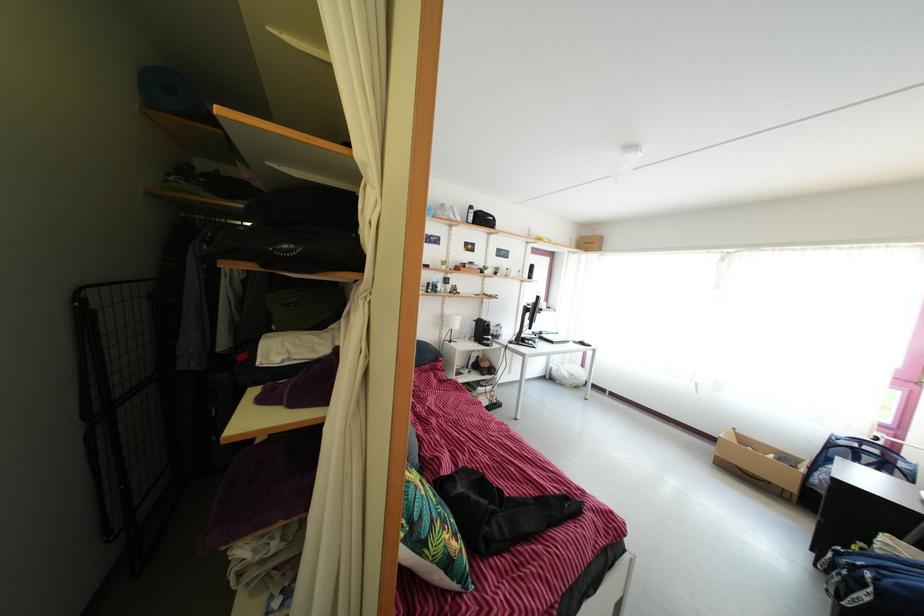
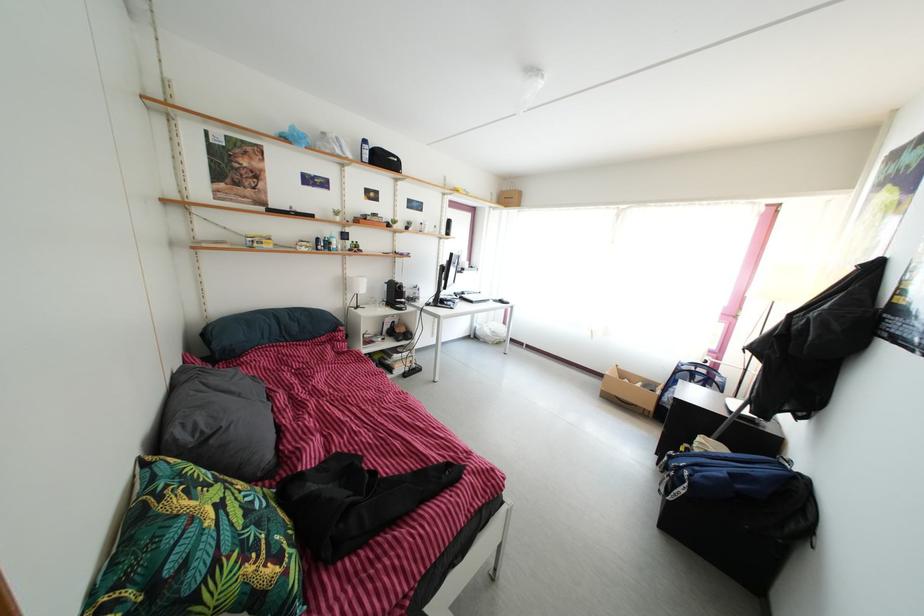
In a continuous first-person perspective shot, in which direction is the camera moving?

The cameraman moved toward right, forward.